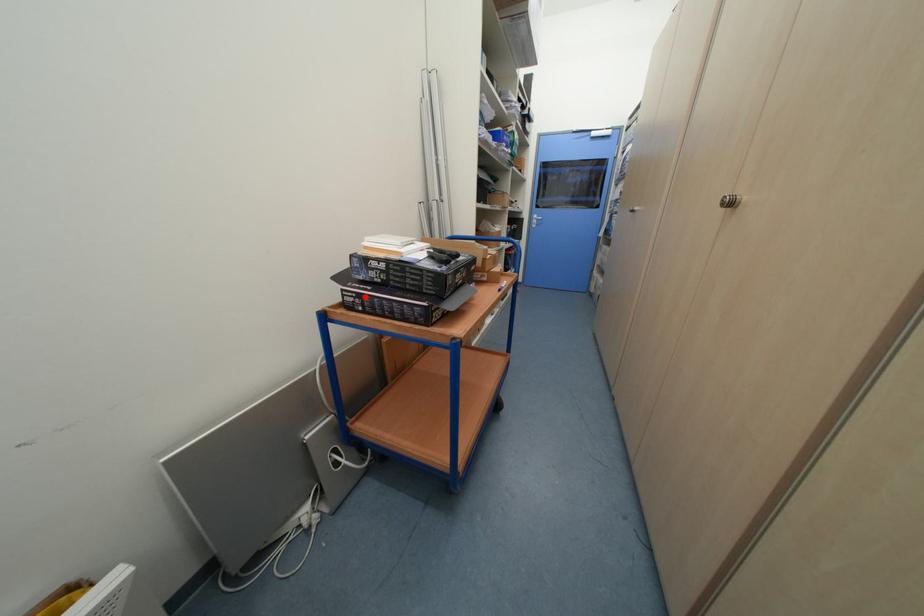
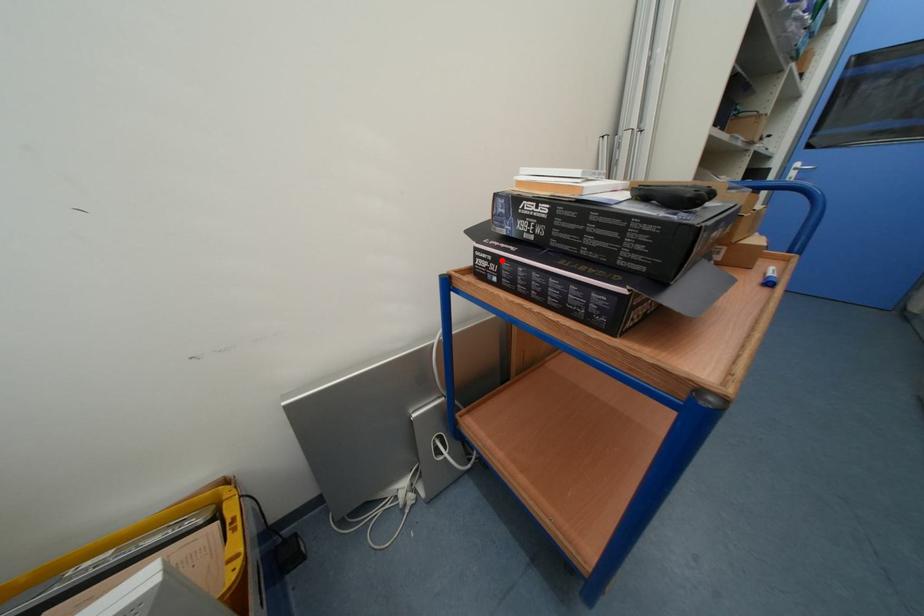
I am providing you with two images of the same scene from different viewpoints. A red point is marked on the first image and another point is marked on the second image. Are the points marked in image1 and image2 representing the same 3D position?

Yes